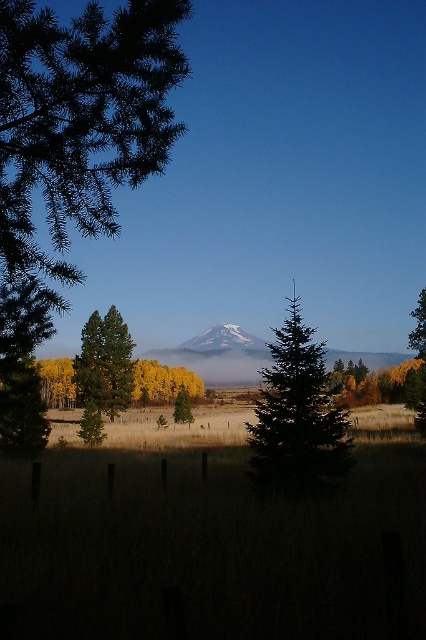
Based on the photo, you are an environmental scientist assessing the health of trees in a mountainous area. You observe two trees in the scene described. Which tree, the green matte tree at left or the green matte tree at center, has a wider canopy based on their visual appearance?

The green matte tree at left has a wider canopy than the green matte tree at center, as its width is larger according to the description.